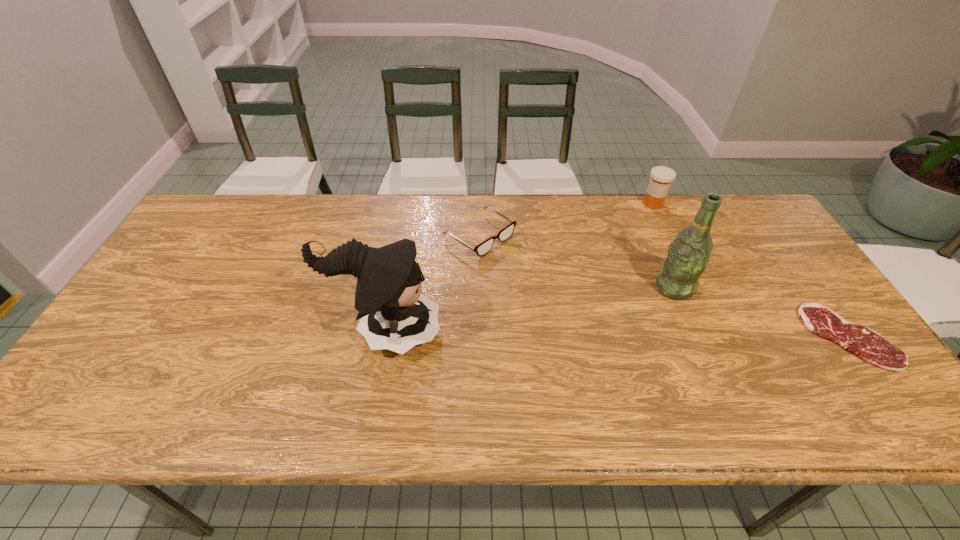
Locate an element on the screen. Image resolution: width=960 pixels, height=540 pixels. free spot on the desktop that is between the doll and the steak and is positioned on the label of the third tallest object is located at coordinates (653, 335).

The height and width of the screenshot is (540, 960). What are the coordinates of `free space on the desktop that is between the doll and the shortest object and is positioned on the front-facing side of the fourth tallest object` in the screenshot? It's located at (630, 334).

I want to click on free space on the desktop that is between the doll and the rightmost object and is positioned on the surface of the beer bottle, so click(593, 334).